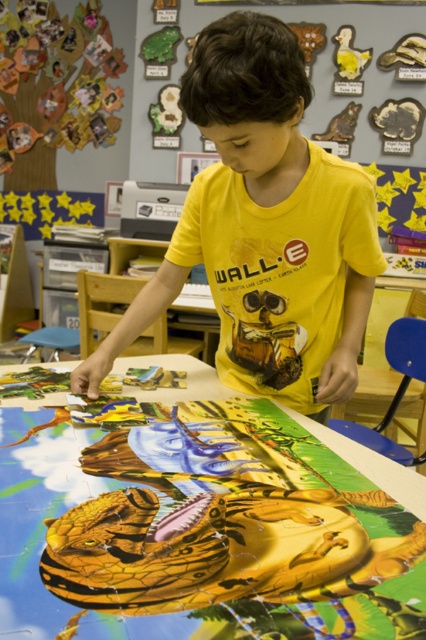
The wooden puzzle pieces at center and the yellow cotton shirt at center are both visible in the image. Which one has a greater width?

The wooden puzzle pieces at center have a greater width than the yellow cotton shirt at center.